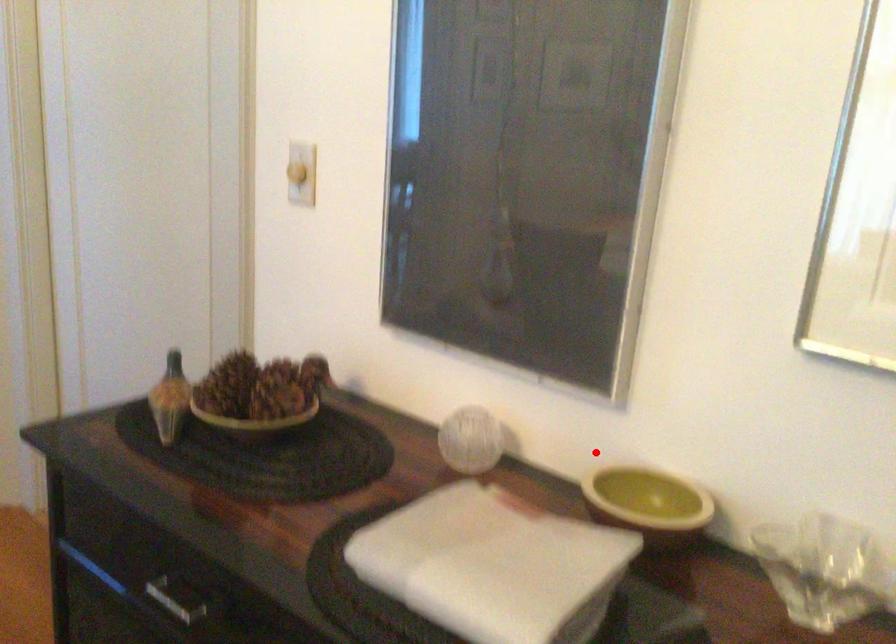
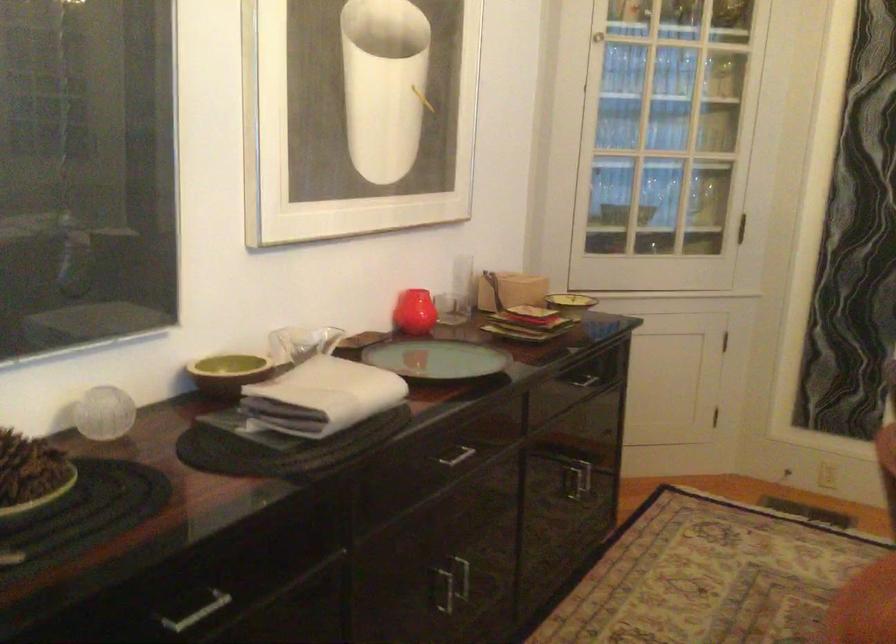
Question: I am providing you with two images of the same scene from different viewpoints. Image1 has a red point marked. In image2, the corresponding 3D location appears at what relative position? Reply with the corresponding letter.

Choices:
 (A) Closer
 (B) Farther

Answer: (B)